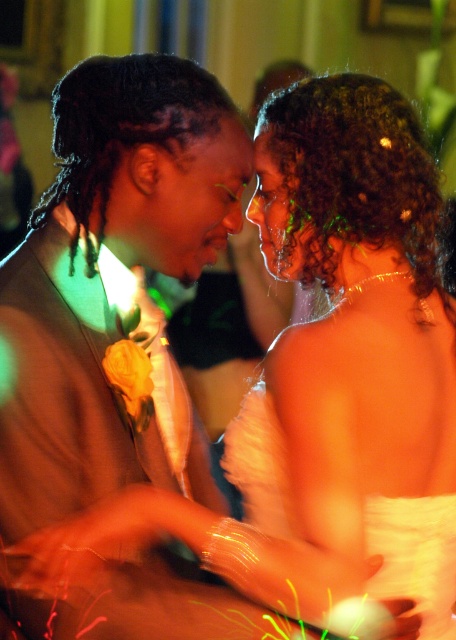
You are a photographer adjusting your camera settings to capture the scene. The white satin dress at center and the matte brown suit at left are in focus. Which object is closer to the camera lens?

The white satin dress at center is positioned under the matte brown suit at left, so the white satin dress at center is closer to the camera lens.

You are a photographer adjusting the camera focus. You have two points to focus on in the image. The first point is point [280,460] and the second is point [119,316]. Which point should you focus on first if you want to capture the subject that is closer to the camera?

Point [280,460] is in front of point [119,316], so you should focus on point [280,460] first because it is closer to the camera.